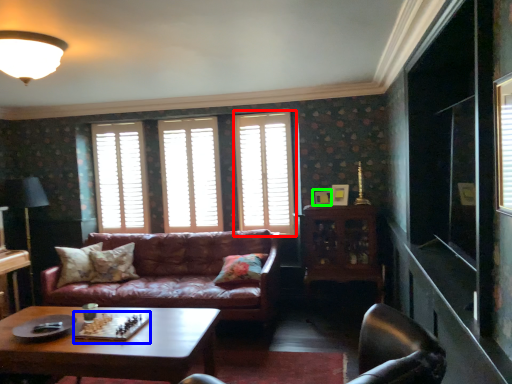
Question: Which object is positioned closest to window (highlighted by a red box)? Select from board game (highlighted by a blue box) and picture frame (highlighted by a green box).

Choices:
 (A) board game
 (B) picture frame

Answer: (B)